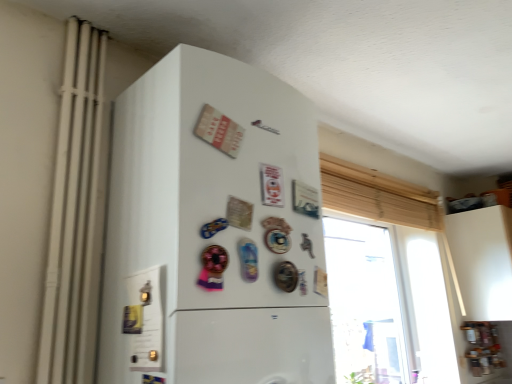
Question: Is white matte radiator at left completely or partially outside of white matte refrigerator at center?

Choices:
 (A) yes
 (B) no

Answer: (A)

Question: From a real-world perspective, is white matte radiator at left located beneath white matte refrigerator at center?

Choices:
 (A) no
 (B) yes

Answer: (A)

Question: Is white matte radiator at left at the left side of white matte refrigerator at center?

Choices:
 (A) yes
 (B) no

Answer: (A)

Question: Is the depth of white matte radiator at left greater than that of white matte refrigerator at center?

Choices:
 (A) no
 (B) yes

Answer: (B)

Question: Considering the relative sizes of white matte radiator at left and white matte refrigerator at center in the image provided, is white matte radiator at left smaller than white matte refrigerator at center?

Choices:
 (A) yes
 (B) no

Answer: (A)

Question: Are white matte radiator at left and white matte refrigerator at center far apart?

Choices:
 (A) no
 (B) yes

Answer: (A)

Question: Does white matte radiator at left lie behind translucent glass window at upper right?

Choices:
 (A) no
 (B) yes

Answer: (A)

Question: From the image's perspective, is white matte radiator at left on translucent glass window at upper right?

Choices:
 (A) yes
 (B) no

Answer: (A)

Question: Considering the relative positions of white matte radiator at left and translucent glass window at upper right in the image provided, is white matte radiator at left to the right of translucent glass window at upper right from the viewer's perspective?

Choices:
 (A) yes
 (B) no

Answer: (B)

Question: Is white matte radiator at left directly adjacent to translucent glass window at upper right?

Choices:
 (A) yes
 (B) no

Answer: (B)

Question: Is translucent glass window at upper right inside white matte radiator at left?

Choices:
 (A) no
 (B) yes

Answer: (A)

Question: From the image's perspective, is white matte radiator at left under translucent glass window at upper right?

Choices:
 (A) yes
 (B) no

Answer: (B)

Question: Considering the relative sizes of translucent glass window at upper right and white matte radiator at left in the image provided, is translucent glass window at upper right wider than white matte radiator at left?

Choices:
 (A) yes
 (B) no

Answer: (A)